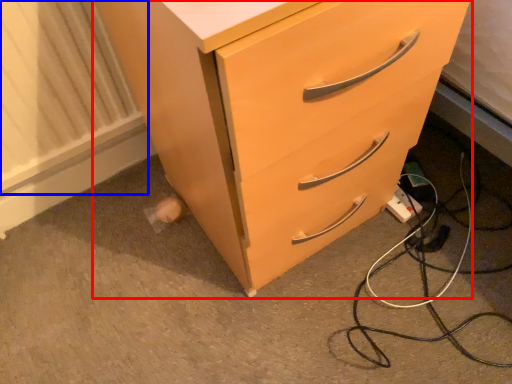
Question: Which object appears closest to the camera in this image, chest of drawers (highlighted by a red box) or radiator (highlighted by a blue box)?

Choices:
 (A) chest of drawers
 (B) radiator

Answer: (A)